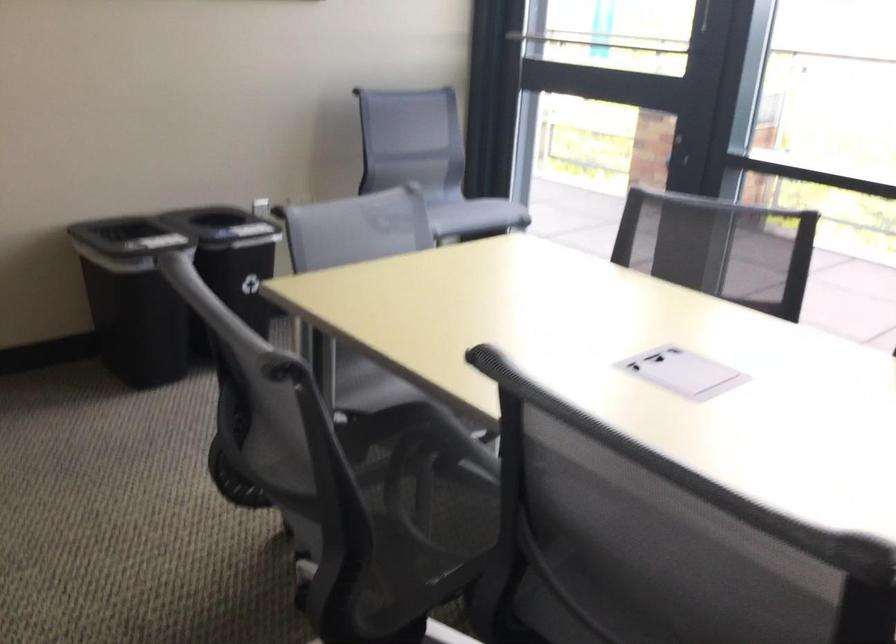
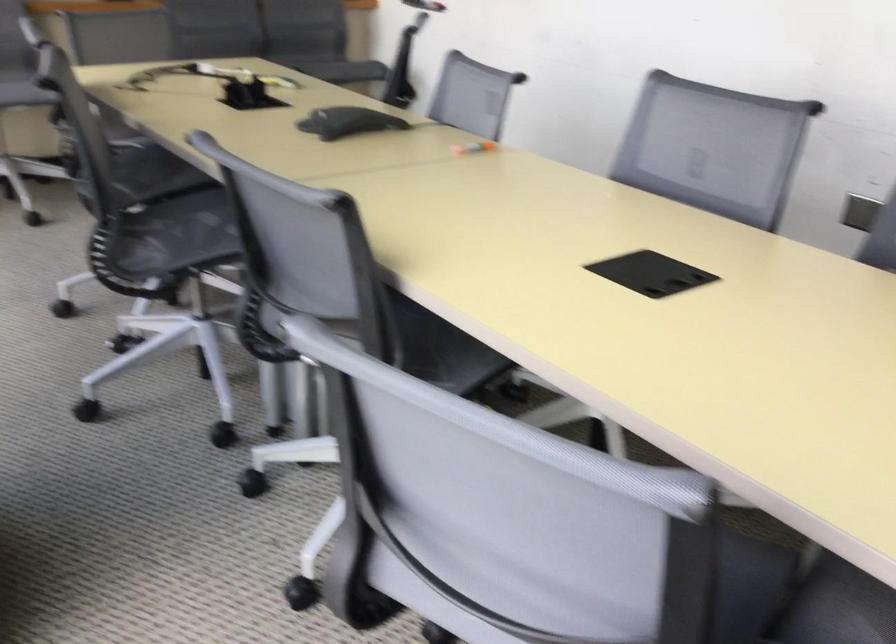
In the second image, find the point that corresponds to point (323, 496) in the first image.

(879, 241)